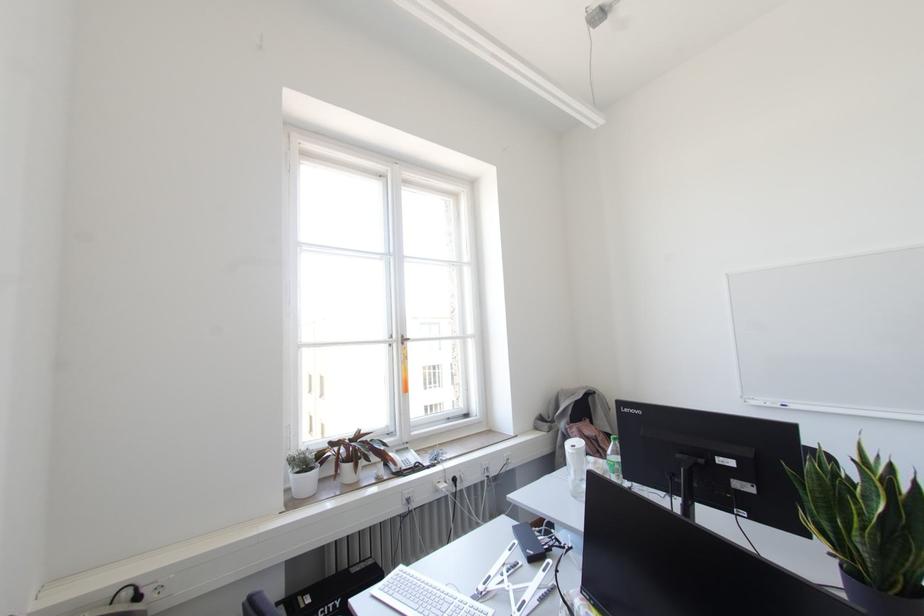
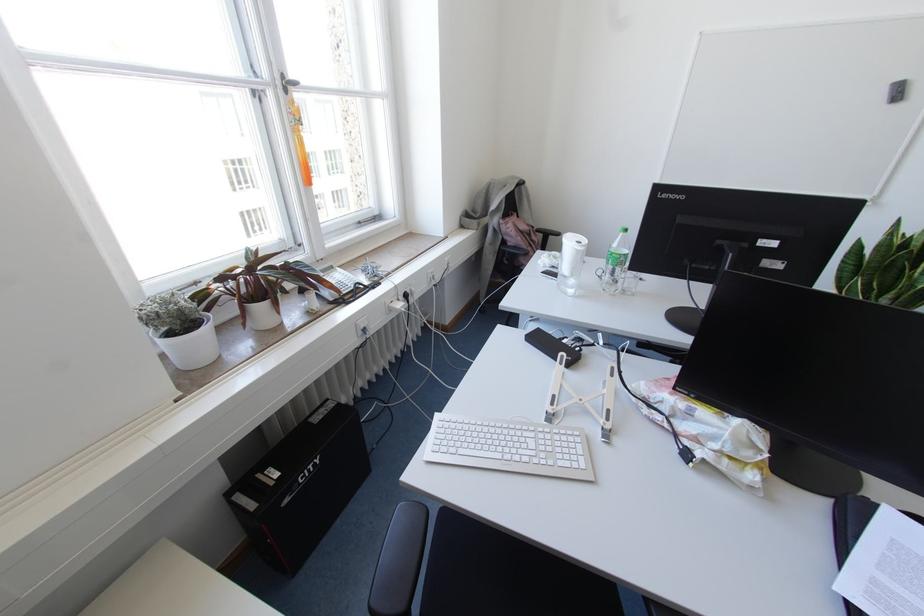
Find the pixel in the second image that matches pixel 402 342 in the first image.

(285, 90)